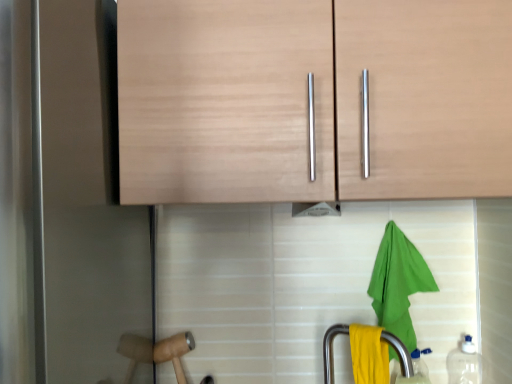
Question: From a real-world perspective, relative to wooden hammer at lower left, is light wood cabinet at upper center vertically above or below?

Choices:
 (A) below
 (B) above

Answer: (B)

Question: From the image's perspective, is light wood cabinet at upper center above or below wooden hammer at lower left?

Choices:
 (A) above
 (B) below

Answer: (A)

Question: Considering the real-world distances, which object is farthest from the green fabric towel at lower right?

Choices:
 (A) wooden hammer at lower left
 (B) transparent plastic bottle at lower right, the 2th bottle viewed from the left
 (C) light wood cabinet at upper center
 (D) transparent plastic bottle at lower right, the 1th bottle in the left-to-right sequence
 (E) yellow matte towel at lower center

Answer: (A)

Question: Which object is positioned farthest from the transparent plastic bottle at lower right, the 1th bottle in the left-to-right sequence?

Choices:
 (A) yellow matte towel at lower center
 (B) wooden hammer at lower left
 (C) light wood cabinet at upper center
 (D) green fabric towel at lower right
 (E) transparent plastic bottle at lower right, the 2th bottle viewed from the left

Answer: (C)